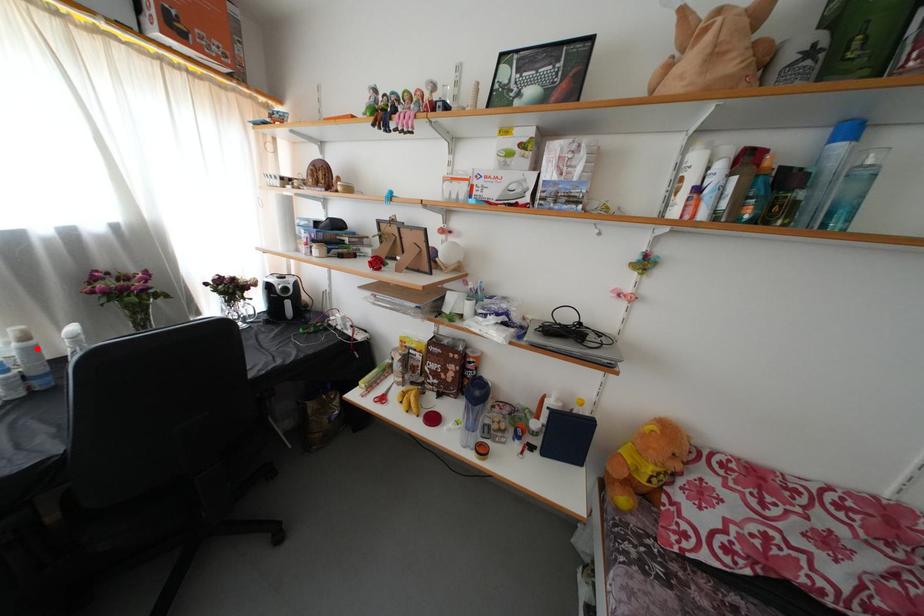
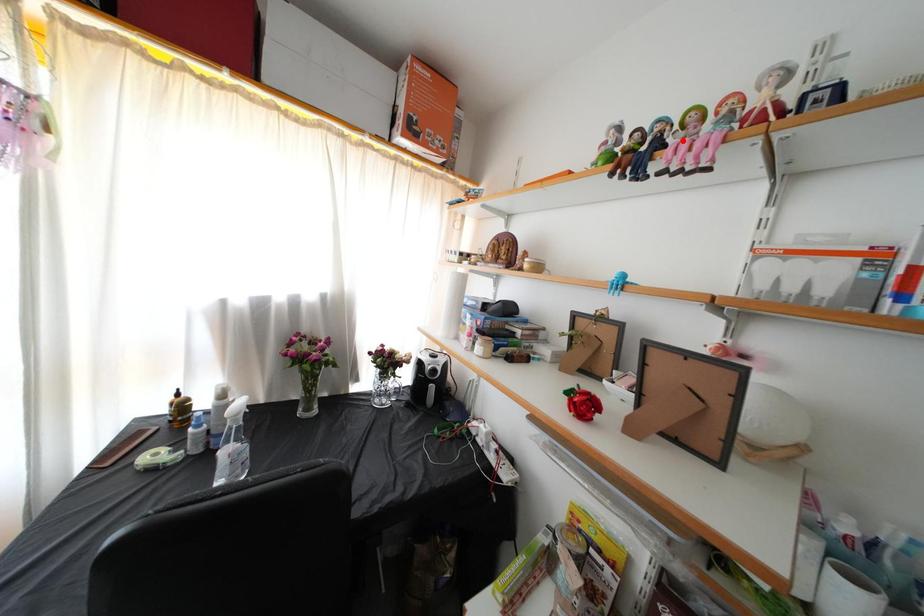
I am providing you with two images of the same scene from different viewpoints. A red point is marked on the first image and another point is marked on the second image. Is the red point in image1 aligned with the point shown in image2?

No